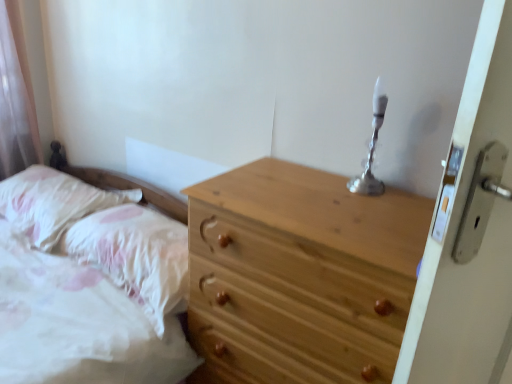
The image size is (512, 384). I want to click on vacant space to the right of silver metallic candle holder at upper right, so click(403, 195).